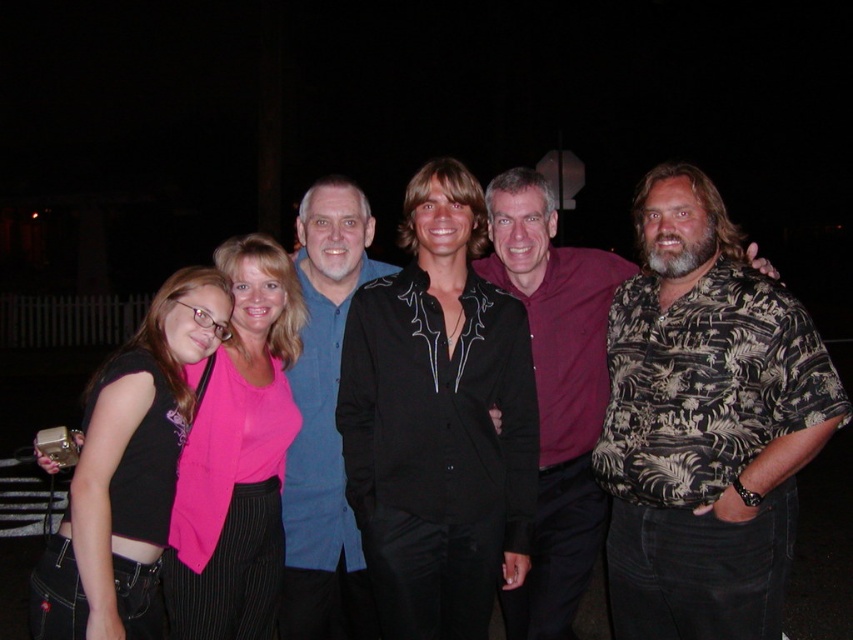
Between black satin blouse at center and blue denim shirt at center, which one is positioned lower?

blue denim shirt at center is lower down.

Does black satin blouse at center have a larger size compared to blue denim shirt at center?

Yes, black satin blouse at center is bigger than blue denim shirt at center.

Where is `black satin blouse at center`? The image size is (853, 640). black satin blouse at center is located at coordinates (438, 420).

This screenshot has height=640, width=853. What are the coordinates of `black satin blouse at center` in the screenshot? It's located at (438, 420).

Is black fabric shirt at left wider than blue denim shirt at center?

Yes.

Can you confirm if black fabric shirt at left is positioned to the left of blue denim shirt at center?

Yes, black fabric shirt at left is to the left of blue denim shirt at center.

Is point (117, 506) behind point (320, 499)?

No, it is in front of (320, 499).

The image size is (853, 640). I want to click on black fabric shirt at left, so click(129, 472).

Measure the distance between printed fabric shirt at center and camera.

printed fabric shirt at center and camera are 2.40 meters apart.

Between point (727, 500) and point (260, 566), which one is positioned in front?

Point (727, 500) is in front.

Is point (619, 387) less distant than point (213, 438)?

No, (619, 387) is behind (213, 438).

This screenshot has width=853, height=640. I want to click on printed fabric shirt at center, so (x=705, y=424).